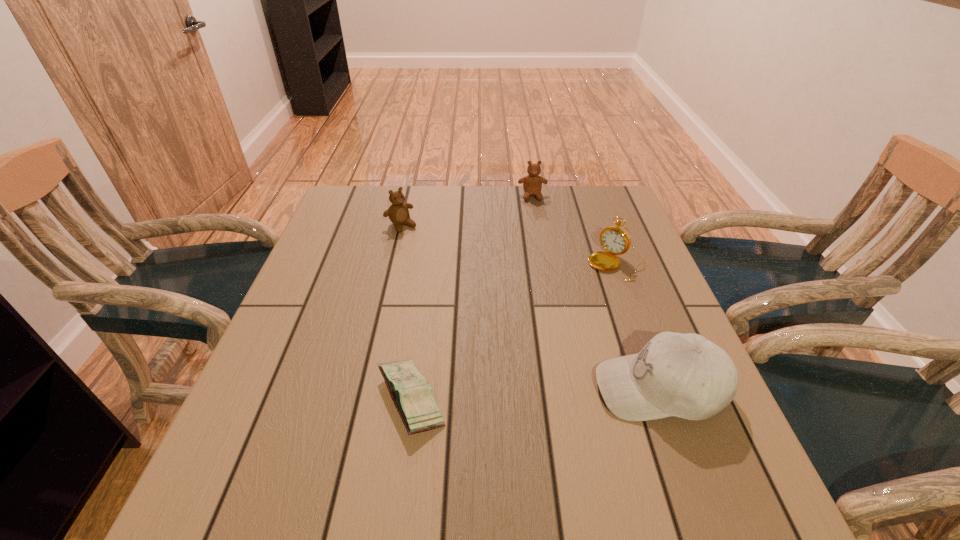
This screenshot has height=540, width=960. I want to click on vacant space on the desktop that is between the diary and the baseball cap and is positioned on the front-facing side of the nearer teddy bear, so click(x=556, y=393).

Find the location of a particular element. Image resolution: width=960 pixels, height=540 pixels. vacant space on the desktop that is between the diary and the baseball cap and is positioned on the face of the farthest object is located at coordinates (559, 393).

Locate an element on the screen. vacant spot on the desktop that is between the diary and the baseball cap and is positioned on the face of the pocket watch is located at coordinates (501, 395).